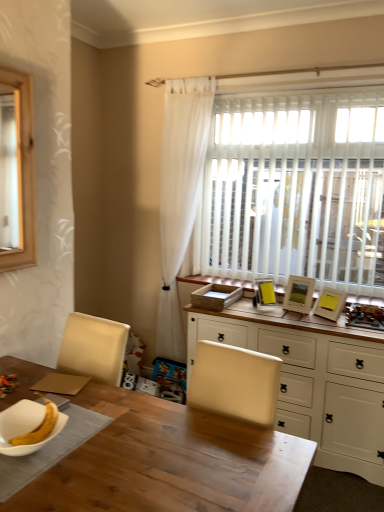
Question: Are matte yellow picture frame at upper right, the first picture frame from the left, and wooden table at center located far from each other?

Choices:
 (A) yes
 (B) no

Answer: (A)

Question: From a real-world perspective, is matte yellow picture frame at upper right, positioned as the third picture frame in right-to-left order, under wooden table at center?

Choices:
 (A) yes
 (B) no

Answer: (B)

Question: Is matte yellow picture frame at upper right, positioned as the third picture frame in right-to-left order, at the right side of wooden table at center?

Choices:
 (A) no
 (B) yes

Answer: (B)

Question: Is matte yellow picture frame at upper right, the first picture frame from the left, bigger than wooden table at center?

Choices:
 (A) no
 (B) yes

Answer: (A)

Question: Is matte yellow picture frame at upper right, the first picture frame from the left, closer to camera compared to wooden table at center?

Choices:
 (A) yes
 (B) no

Answer: (B)

Question: Is wooden table at center taller or shorter than white glossy bowl at lower left?

Choices:
 (A) tall
 (B) short

Answer: (A)

Question: Do you think wooden table at center is within white glossy bowl at lower left, or outside of it?

Choices:
 (A) inside
 (B) outside

Answer: (B)

Question: Looking at their shapes, would you say wooden table at center is wider or thinner than white glossy bowl at lower left?

Choices:
 (A) thin
 (B) wide

Answer: (B)

Question: Would you say wooden table at center is to the left or to the right of white glossy bowl at lower left in the picture?

Choices:
 (A) left
 (B) right

Answer: (B)

Question: Would you say matte yellow picture frame at upper right, positioned as the third picture frame in right-to-left order, is inside or outside white wood cabinet at center?

Choices:
 (A) inside
 (B) outside

Answer: (B)

Question: Considering the positions of matte yellow picture frame at upper right, the first picture frame from the left, and white wood cabinet at center in the image, is matte yellow picture frame at upper right, the first picture frame from the left, bigger or smaller than white wood cabinet at center?

Choices:
 (A) big
 (B) small

Answer: (B)

Question: From the image's perspective, is matte yellow picture frame at upper right, the first picture frame from the left, above or below white wood cabinet at center?

Choices:
 (A) above
 (B) below

Answer: (A)

Question: Does point tap(263, 303) appear closer or farther from the camera than point tap(379, 374)?

Choices:
 (A) closer
 (B) farther

Answer: (B)

Question: Is point (321, 291) closer or farther from the camera than point (291, 281)?

Choices:
 (A) closer
 (B) farther

Answer: (A)

Question: From a real-world perspective, relative to wooden photo frame at right, the second picture frame in the left-to-right sequence, is wooden picture frame at upper right, which appears as the 3th picture frame when viewed from the left, vertically above or below?

Choices:
 (A) above
 (B) below

Answer: (B)